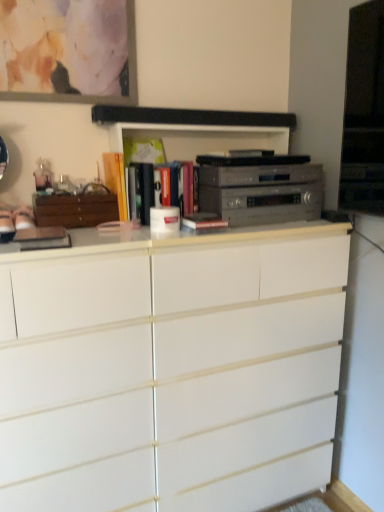
In the scene shown: What is the approximate width of hardcover book at center, which is the 1th book from right to left?

hardcover book at center, which is the 1th book from right to left, is 6.62 inches wide.

This screenshot has width=384, height=512. What do you see at coordinates (68, 51) in the screenshot?
I see `matte glass picture frame at upper left` at bounding box center [68, 51].

Where is `matte orange book at center, the fourth book positioned from the right`? The image size is (384, 512). matte orange book at center, the fourth book positioned from the right is located at coordinates (116, 180).

What do you see at coordinates (116, 180) in the screenshot?
I see `matte orange book at center, placed as the 1th book when sorted from left to right` at bounding box center [116, 180].

What do you see at coordinates (75, 209) in the screenshot?
I see `wooden cabinet at left` at bounding box center [75, 209].

The height and width of the screenshot is (512, 384). What are the coordinates of `white matte chest of drawers at center` in the screenshot? It's located at (172, 370).

Considering the positions of point (110, 177) and point (200, 220), is point (110, 177) closer or farther from the camera than point (200, 220)?

Point (110, 177).

From the image's perspective, which one is positioned lower, matte orange book at center, the fourth book positioned from the right, or hardcover book at center, which is the 1th book from right to left?

→ hardcover book at center, which is the 1th book from right to left, is shown below in the image.

Which object is further away from the camera, matte orange book at center, placed as the 1th book when sorted from left to right, or hardcover book at center, positioned as the 4th book in left-to-right order?

matte orange book at center, placed as the 1th book when sorted from left to right.

Which point is more distant from viewer, (143, 164) or (28, 28)?

The point (143, 164) is more distant.

From the image's perspective, is hardcover book at center, which is the third book from left to right, located above or below matte glass picture frame at upper left?

From the image's perspective, hardcover book at center, which is the third book from left to right, appears below matte glass picture frame at upper left.

Is hardcover book at center, which is the 2th book from right to left, positioned with its back to matte glass picture frame at upper left?

hardcover book at center, which is the 2th book from right to left, does not have its back to matte glass picture frame at upper left.

Is silver metallic stereo at center positioned with its back to white matte chest of drawers at center?

silver metallic stereo at center is not turned away from white matte chest of drawers at center.

Is point (291, 215) closer to viewer compared to point (57, 497)?

No, it is behind (57, 497).

Is silver metallic stereo at center taller or shorter than white matte chest of drawers at center?

Clearly, silver metallic stereo at center is shorter compared to white matte chest of drawers at center.

Who is smaller, silver metallic stereo at center or white matte chest of drawers at center?

With smaller size is silver metallic stereo at center.

Who is shorter, white matte chest of drawers at center or silver metallic stereo at center?

silver metallic stereo at center is shorter.

Is white matte chest of drawers at center far from silver metallic stereo at center?

That's not correct — white matte chest of drawers at center is a little close to silver metallic stereo at center.

From the image's perspective, is white matte chest of drawers at center beneath silver metallic stereo at center?

Correct, white matte chest of drawers at center appears lower than silver metallic stereo at center in the image.

Which is less distant, (108,165) or (147,170)?

Point (108,165) is positioned farther from the camera compared to point (147,170).

In the image, is matte orange book at center, the fourth book positioned from the right, on the left side or the right side of hardcover book at center, which is the 2th book from right to left?

matte orange book at center, the fourth book positioned from the right, is to the left of hardcover book at center, which is the 2th book from right to left.

Is matte orange book at center, placed as the 1th book when sorted from left to right, turned away from hardcover book at center, which is the third book from left to right?

No.

The width and height of the screenshot is (384, 512). What are the coordinates of `book that is the 2nd one when counting leftward from the hardcover book at center, which is the third book from left to right` in the screenshot? It's located at (116, 180).

Considering the relative positions of white matte chest of drawers at center and matte glass picture frame at upper left in the image provided, is white matte chest of drawers at center in front of matte glass picture frame at upper left?

Yes, white matte chest of drawers at center is closer to the camera.

Identify the location of picture frame on the left of white matte chest of drawers at center. (68, 51).

Is white matte chest of drawers at center to the left of matte glass picture frame at upper left from the viewer's perspective?

In fact, white matte chest of drawers at center is to the right of matte glass picture frame at upper left.

Choose the correct answer: Is white matte chest of drawers at center inside matte glass picture frame at upper left or outside it?

white matte chest of drawers at center cannot be found inside matte glass picture frame at upper left.

Can you confirm if white matte chest of drawers at center is thinner than hardcover book at center, positioned as the 4th book in left-to-right order?

No, white matte chest of drawers at center is not thinner than hardcover book at center, positioned as the 4th book in left-to-right order.

Does white matte chest of drawers at center appear on the right side of hardcover book at center, which is the 1th book from right to left?

No, white matte chest of drawers at center is not to the right of hardcover book at center, which is the 1th book from right to left.

From the image's perspective, is white matte chest of drawers at center below hardcover book at center, positioned as the 4th book in left-to-right order?

Yes, from the image's perspective, white matte chest of drawers at center is beneath hardcover book at center, positioned as the 4th book in left-to-right order.

From a real-world perspective, is white matte chest of drawers at center positioned under hardcover book at center, which is the 1th book from right to left, based on gravity?

Yes, from a real-world perspective, white matte chest of drawers at center is below hardcover book at center, which is the 1th book from right to left.

Where is `book that is the 2nd one when counting downward from the matte orange book at center, placed as the 1th book when sorted from left to right (from the image's perspective)`? This screenshot has height=512, width=384. book that is the 2nd one when counting downward from the matte orange book at center, placed as the 1th book when sorted from left to right (from the image's perspective) is located at coordinates (203, 221).

You are a GUI agent. You are given a task and a screenshot of the screen. Output one action in this format:
    pyautogui.click(x=<x>, y=<y>)
    Task: Click on the picture frame lying on the left of hardcover book at center, which is the 2th book from right to left
    
    Given the screenshot: What is the action you would take?
    pyautogui.click(x=68, y=51)

Looking at the image, which one is located closer to silver metallic stereo at center, matte yellow book at center, which ranks as the third book in right-to-left order, or matte orange book at center, the fourth book positioned from the right?

matte yellow book at center, which ranks as the third book in right-to-left order, lies closer to silver metallic stereo at center than the other object.

Estimate the real-world distances between objects in this image. Which object is further from matte orange book at center, the fourth book positioned from the right, matte yellow book at center, which ranks as the third book in right-to-left order, or hardcover book at center, which is the 1th book from right to left?

Based on the image, hardcover book at center, which is the 1th book from right to left, appears to be further to matte orange book at center, the fourth book positioned from the right.

Which object lies nearer to the anchor point hardcover book at center, which is the 2th book from right to left, hardcover book at center, positioned as the 4th book in left-to-right order, or matte yellow book at center, which ranks as the third book in right-to-left order?

matte yellow book at center, which ranks as the third book in right-to-left order, is positioned closer to the anchor hardcover book at center, which is the 2th book from right to left.

From the image, which object appears to be farther from matte glass picture frame at upper left, hardcover book at center, which is the 1th book from right to left, or silver metallic stereo at center?

Among the two, hardcover book at center, which is the 1th book from right to left, is located further to matte glass picture frame at upper left.

When comparing their distances from silver metallic stereo at center, does hardcover book at center, which is the 1th book from right to left, or white matte chest of drawers at center seem closer?

hardcover book at center, which is the 1th book from right to left, lies closer to silver metallic stereo at center than the other object.

Which object lies further to the anchor point silver metallic stereo at center, matte yellow book at center, which ranks as the third book in right-to-left order, or matte glass picture frame at upper left?

matte glass picture frame at upper left.

When comparing their distances from hardcover book at center, positioned as the 4th book in left-to-right order, does silver metallic stereo at center or matte orange book at center, the fourth book positioned from the right, seem closer?

Based on the image, silver metallic stereo at center appears to be nearer to hardcover book at center, positioned as the 4th book in left-to-right order.

Looking at the image, which one is located closer to matte yellow book at center, marked as the 2th book in a left-to-right arrangement, matte glass picture frame at upper left or white matte chest of drawers at center?

matte glass picture frame at upper left is positioned closer to the anchor matte yellow book at center, marked as the 2th book in a left-to-right arrangement.

Where is `cabinetry between hardcover book at center, which is the third book from left to right, and white matte chest of drawers at center from top to bottom`? cabinetry between hardcover book at center, which is the third book from left to right, and white matte chest of drawers at center from top to bottom is located at coordinates (75, 209).

The height and width of the screenshot is (512, 384). I want to click on home appliance between matte glass picture frame at upper left and white matte chest of drawers at center in the vertical direction, so click(x=260, y=188).

Locate an element on the screen. cabinetry between matte glass picture frame at upper left and white matte chest of drawers at center vertically is located at coordinates (75, 209).

Locate an element on the screen. book between wooden cabinet at left and white matte chest of drawers at center from top to bottom is located at coordinates (203, 221).